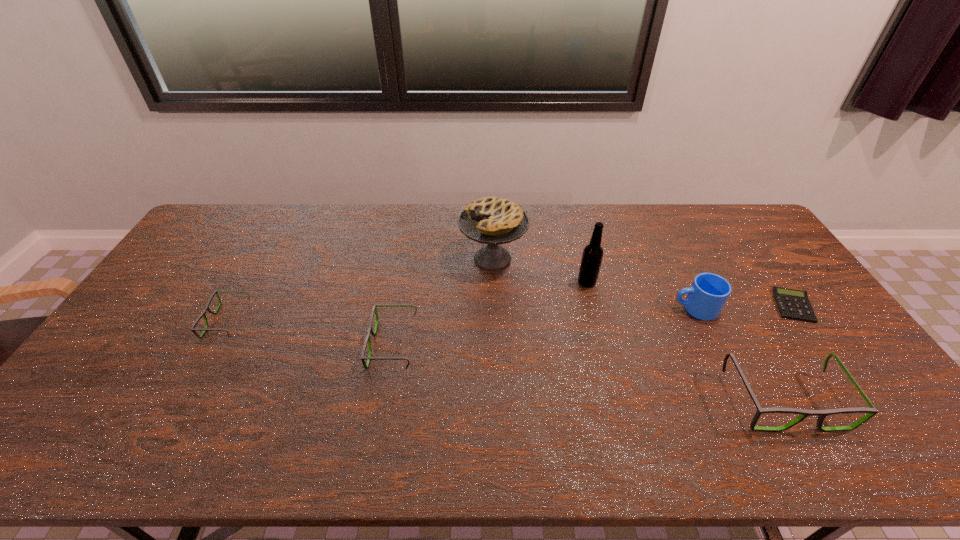
In order to click on vacant area situated on the lens of the leftmost spectacles in this screenshot , I will do `click(153, 321)`.

The width and height of the screenshot is (960, 540). Find the location of `vacant region located 0.100m on the lens of the leftmost spectacles`. vacant region located 0.100m on the lens of the leftmost spectacles is located at coordinates (177, 321).

At what (x,y) coordinates should I click in order to perform the action: click on vacant space located on the lens of the leftmost spectacles. Please return your answer as a coordinate pair (x, y). This screenshot has height=540, width=960. Looking at the image, I should click on (186, 321).

Where is `vacant position located on the lens of the second spectacles from left to right`? vacant position located on the lens of the second spectacles from left to right is located at coordinates (324, 345).

Where is `free region located 0.280m on the lens of the second spectacles from left to right`? This screenshot has width=960, height=540. free region located 0.280m on the lens of the second spectacles from left to right is located at coordinates (271, 345).

Locate an element on the screen. This screenshot has width=960, height=540. free space located 0.240m on the lens of the second spectacles from left to right is located at coordinates (285, 345).

Locate an element on the screen. The image size is (960, 540). free space located on the back of the beer bottle is located at coordinates (577, 245).

Where is `free space located 0.160m on the back of the shortest object`? The height and width of the screenshot is (540, 960). free space located 0.160m on the back of the shortest object is located at coordinates (758, 257).

In order to click on blank space located 0.380m on the cut side of the third object from left to right in this screenshot , I will do `click(347, 259)`.

The height and width of the screenshot is (540, 960). In order to click on vacant region located on the cut side of the third object from left to right in this screenshot , I will do `click(441, 259)`.